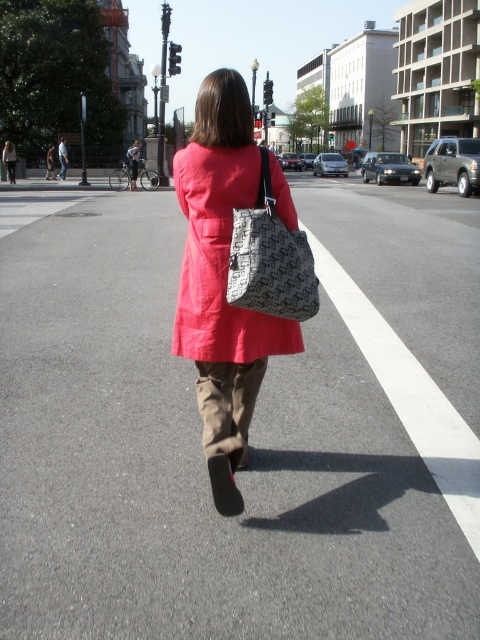
Between point (195, 250) and point (178, 332), which one is positioned behind?

The point (178, 332) is behind.

From the picture: Is cotton coat at center in front of matte pink coat at center?

No.

Is point (251, 410) in front of point (187, 262)?

No, (251, 410) is further to viewer.

Find the location of `cotton coat at center`. cotton coat at center is located at coordinates (222, 280).

Does cotton coat at center appear on the right side of gray textured tote at center?

In fact, cotton coat at center is to the left of gray textured tote at center.

Is cotton coat at center to the left of gray textured tote at center from the viewer's perspective?

Yes, cotton coat at center is to the left of gray textured tote at center.

Who is more forward, [238,337] or [303,237]?

Point [238,337]

This screenshot has width=480, height=640. I want to click on cotton coat at center, so (x=222, y=280).

Does matte pink coat at center lie behind gray textured tote at center?

Yes.

Which is in front, point (226, 228) or point (282, 278)?

Point (282, 278) is more forward.

Is point (193, 177) closer to viewer compared to point (263, 218)?

No.

Locate an element on the screen. The image size is (480, 640). matte pink coat at center is located at coordinates (219, 260).